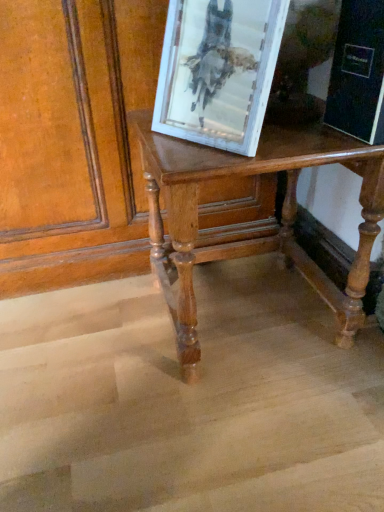
Identify the location of space that is in front of white distressed wood picture frame at upper center. (199, 158).